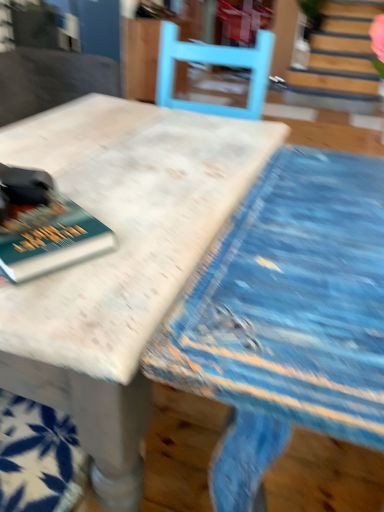
Question: Does hardcover book at left come behind white marble table at center?

Choices:
 (A) no
 (B) yes

Answer: (B)

Question: From a real-world perspective, is hardcover book at left located beneath white marble table at center?

Choices:
 (A) yes
 (B) no

Answer: (B)

Question: Does hardcover book at left have a lesser width compared to white marble table at center?

Choices:
 (A) yes
 (B) no

Answer: (A)

Question: Considering the relative sizes of hardcover book at left and white marble table at center in the image provided, is hardcover book at left smaller than white marble table at center?

Choices:
 (A) no
 (B) yes

Answer: (B)

Question: Considering the relative positions of hardcover book at left and white marble table at center in the image provided, is hardcover book at left to the right of white marble table at center from the viewer's perspective?

Choices:
 (A) yes
 (B) no

Answer: (B)

Question: Does hardcover book at left have a greater width compared to white marble table at center?

Choices:
 (A) yes
 (B) no

Answer: (B)

Question: Is white marble table at center not inside hardcover book at left?

Choices:
 (A) yes
 (B) no

Answer: (A)

Question: Is white marble table at center further to camera compared to hardcover book at left?

Choices:
 (A) yes
 (B) no

Answer: (B)

Question: Can you confirm if white marble table at center is bigger than hardcover book at left?

Choices:
 (A) yes
 (B) no

Answer: (A)

Question: From the image's perspective, is white marble table at center located beneath hardcover book at left?

Choices:
 (A) yes
 (B) no

Answer: (A)

Question: Does white marble table at center appear on the left side of hardcover book at left?

Choices:
 (A) no
 (B) yes

Answer: (A)

Question: Does white marble table at center have a greater width compared to hardcover book at left?

Choices:
 (A) yes
 (B) no

Answer: (A)

Question: In terms of size, does hardcover book at left appear bigger or smaller than white marble table at center?

Choices:
 (A) small
 (B) big

Answer: (A)